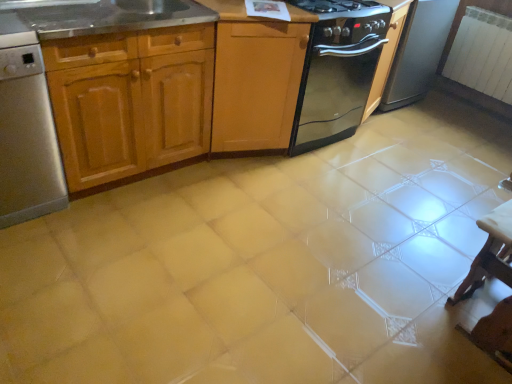
Question: Should I look upward or downward to see black glossy oven at upper right?

Choices:
 (A) down
 (B) up

Answer: (B)

Question: Considering the relative sizes of white glossy table at lower right and black glass stove at center in the image provided, is white glossy table at lower right taller than black glass stove at center?

Choices:
 (A) yes
 (B) no

Answer: (B)

Question: Does white glossy table at lower right have a lesser height compared to black glass stove at center?

Choices:
 (A) yes
 (B) no

Answer: (A)

Question: From a real-world perspective, does white glossy table at lower right sit lower than black glass stove at center?

Choices:
 (A) no
 (B) yes

Answer: (B)

Question: Is white glossy table at lower right next to black glass stove at center?

Choices:
 (A) yes
 (B) no

Answer: (B)

Question: Is white glossy table at lower right wider than black glass stove at center?

Choices:
 (A) yes
 (B) no

Answer: (B)

Question: Is white glossy table at lower right looking in the opposite direction of black glass stove at center?

Choices:
 (A) no
 (B) yes

Answer: (B)

Question: From a real-world perspective, does black glass stove at center sit lower than stainless steel sink at upper left?

Choices:
 (A) no
 (B) yes

Answer: (B)

Question: From the image's perspective, is black glass stove at center over stainless steel sink at upper left?

Choices:
 (A) no
 (B) yes

Answer: (A)

Question: Is the position of black glass stove at center less distant than that of stainless steel sink at upper left?

Choices:
 (A) no
 (B) yes

Answer: (A)

Question: Does black glass stove at center have a greater height compared to stainless steel sink at upper left?

Choices:
 (A) no
 (B) yes

Answer: (B)

Question: From a real-world perspective, is black glass stove at center located higher than stainless steel sink at upper left?

Choices:
 (A) no
 (B) yes

Answer: (A)

Question: Could stainless steel sink at upper left be considered to be inside black glass stove at center?

Choices:
 (A) no
 (B) yes

Answer: (A)

Question: Does stainless steel dishwasher at left appear on the left side of black glass stove at center?

Choices:
 (A) no
 (B) yes

Answer: (B)